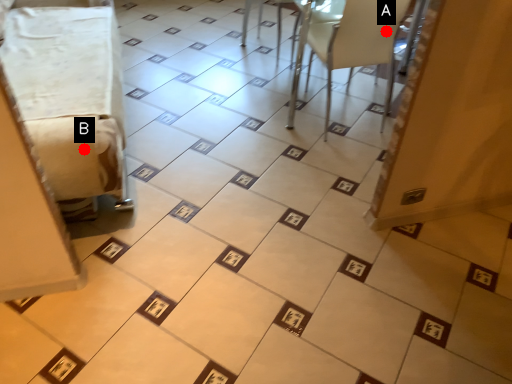
Question: Two points are circled on the image, labeled by A and B beside each circle. Which point is further to the camera?

Choices:
 (A) A is further
 (B) B is further

Answer: (A)